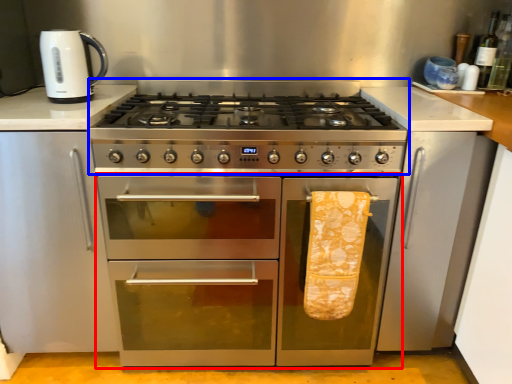
Question: Which object appears closest to the camera in this image, oven (highlighted by a red box) or gas stove (highlighted by a blue box)?

Choices:
 (A) oven
 (B) gas stove

Answer: (B)